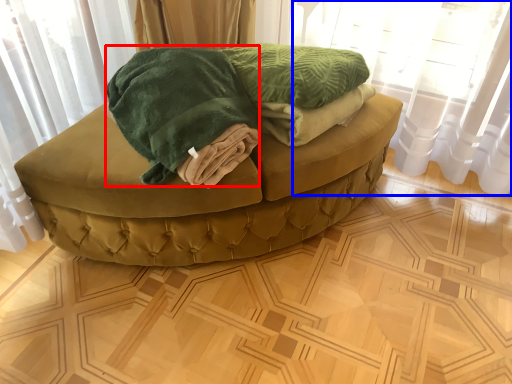
Question: Which point is closer to the camera, cloth (highlighted by a red box) or curtain (highlighted by a blue box)?

Choices:
 (A) cloth
 (B) curtain

Answer: (A)